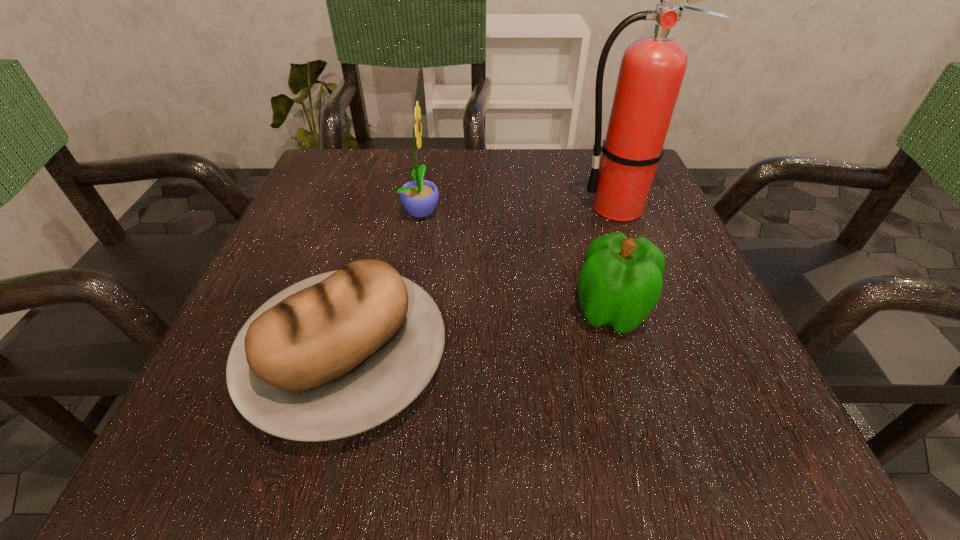
You are a GUI agent. You are given a task and a screenshot of the screen. Output one action in this format:
    pyautogui.click(x=<x>, y=<y>)
    Task: Click on the fire extinguisher present at the far edge
    This screenshot has width=960, height=540.
    Given the screenshot: What is the action you would take?
    pyautogui.click(x=652, y=69)

The width and height of the screenshot is (960, 540). Find the location of `sunflower positioned at the far edge`. sunflower positioned at the far edge is located at coordinates (419, 197).

Where is `object at the near edge`? This screenshot has width=960, height=540. object at the near edge is located at coordinates (339, 353).

Where is `object at the left edge`? object at the left edge is located at coordinates coord(339,353).

Identify the location of fire extinguisher at the right edge. (652, 69).

Identify the location of bell pepper situated at the right edge. The width and height of the screenshot is (960, 540). (620, 282).

Find the location of `object situated at the near left corner`. object situated at the near left corner is located at coordinates (339, 353).

I want to click on object at the far right corner, so click(652, 69).

Where is `blank space at the far edge of the desktop`? The height and width of the screenshot is (540, 960). blank space at the far edge of the desktop is located at coordinates (472, 175).

Where is `vacant region at the near edge`? The image size is (960, 540). vacant region at the near edge is located at coordinates (628, 465).